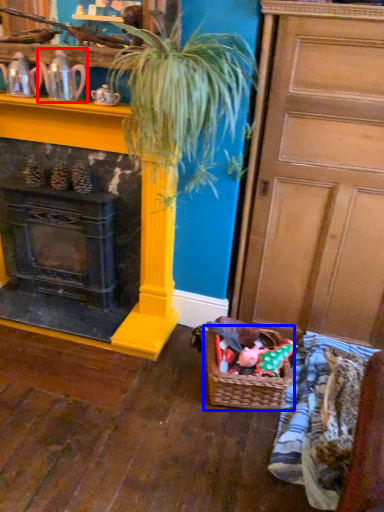
Question: Which object appears closest to the camera in this image, tea pot (highlighted by a red box) or basket (highlighted by a blue box)?

Choices:
 (A) tea pot
 (B) basket

Answer: (A)